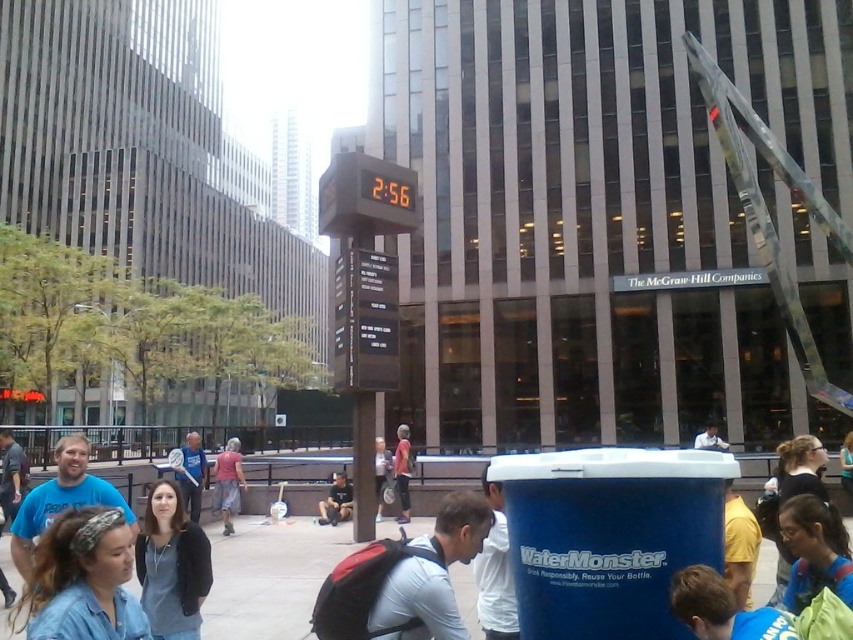
Can you confirm if blue fabric jacket at lower right is positioned above white matte water cooler at lower right?

Yes, blue fabric jacket at lower right is above white matte water cooler at lower right.

Is the position of blue fabric jacket at lower right less distant than that of white matte water cooler at lower right?

Yes, it is.

Is point (804, 531) less distant than point (488, 488)?

That is True.

In order to click on blue fabric jacket at lower right in this screenshot , I will do `click(814, 552)`.

Is point (21, 608) less distant than point (190, 525)?

Yes, it is in front of point (190, 525).

Can you confirm if denim jacket at lower left is positioned below dark gray sweater at center?

Actually, denim jacket at lower left is above dark gray sweater at center.

What do you see at coordinates (82, 580) in the screenshot? The image size is (853, 640). I see `denim jacket at lower left` at bounding box center [82, 580].

Identify the location of denim jacket at lower left. (82, 580).

Does blue plastic container at center have a larger size compared to dark blue jeans at center?

Correct, blue plastic container at center is larger in size than dark blue jeans at center.

Which of these two, blue plastic container at center or dark blue jeans at center, stands taller?

blue plastic container at center

Find the location of a particular element. blue plastic container at center is located at coordinates (270, 577).

You are a GUI agent. You are given a task and a screenshot of the screen. Output one action in this format:
    pyautogui.click(x=<x>, y=<y>)
    Task: Click on the blue plastic container at center
    This screenshot has width=853, height=640.
    Given the screenshot: What is the action you would take?
    pyautogui.click(x=270, y=577)